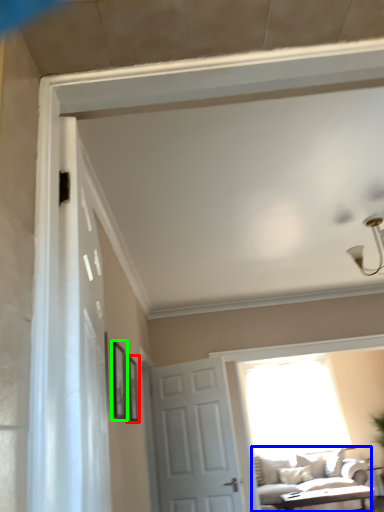
Question: Which object is the closest to the picture frame (highlighted by a red box)? Choose among these: studio couch (highlighted by a blue box) or picture frame (highlighted by a green box).

Choices:
 (A) studio couch
 (B) picture frame

Answer: (B)